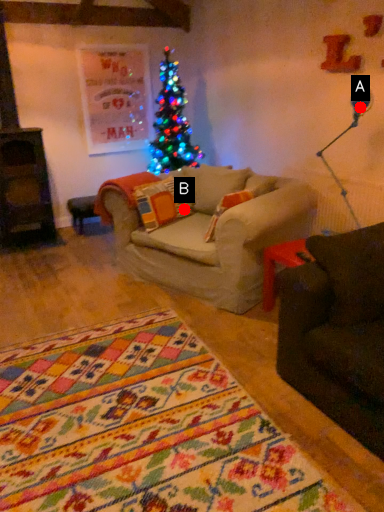
Question: Two points are circled on the image, labeled by A and B beside each circle. Which of the following is the farthest from the observer?

Choices:
 (A) A is further
 (B) B is further

Answer: (B)